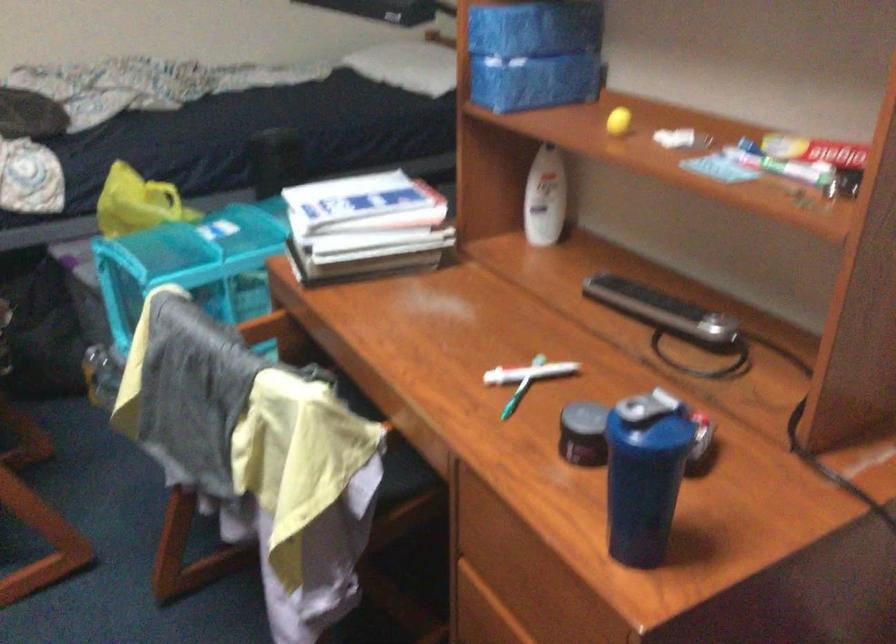
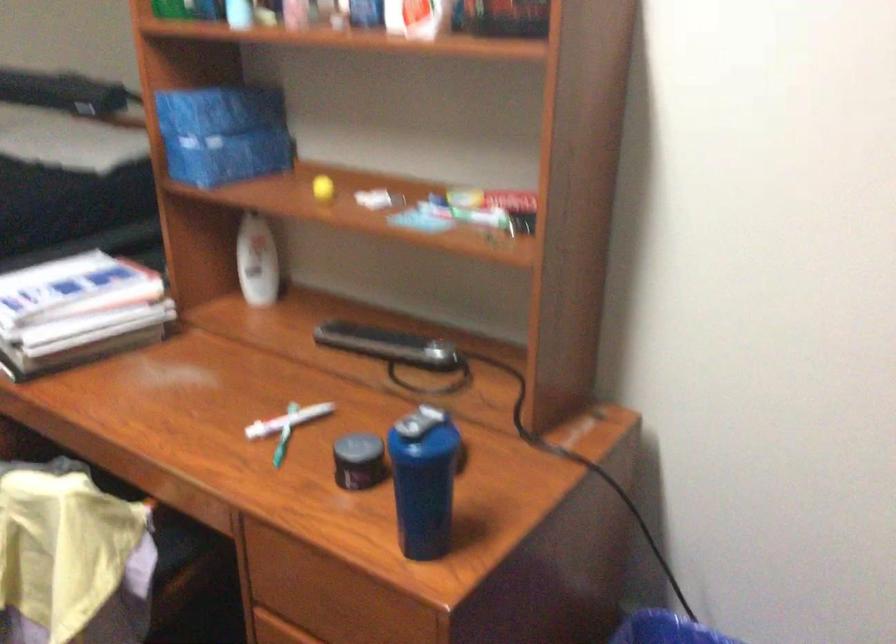
The images are taken continuously from a first-person perspective. In which direction are you moving?

The cameraman walked toward left, backward.